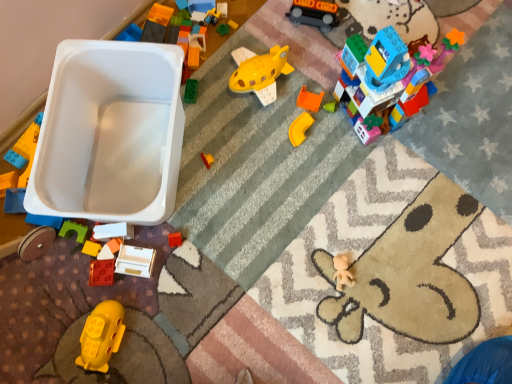
Where is `vacant space that is in between rubber brick at lower left, marked as the 2th toy in a left-to-right arrangement, and multicolored plastic building block at upper right, the first toy when ordered from right to left`? Image resolution: width=512 pixels, height=384 pixels. vacant space that is in between rubber brick at lower left, marked as the 2th toy in a left-to-right arrangement, and multicolored plastic building block at upper right, the first toy when ordered from right to left is located at coordinates (266, 173).